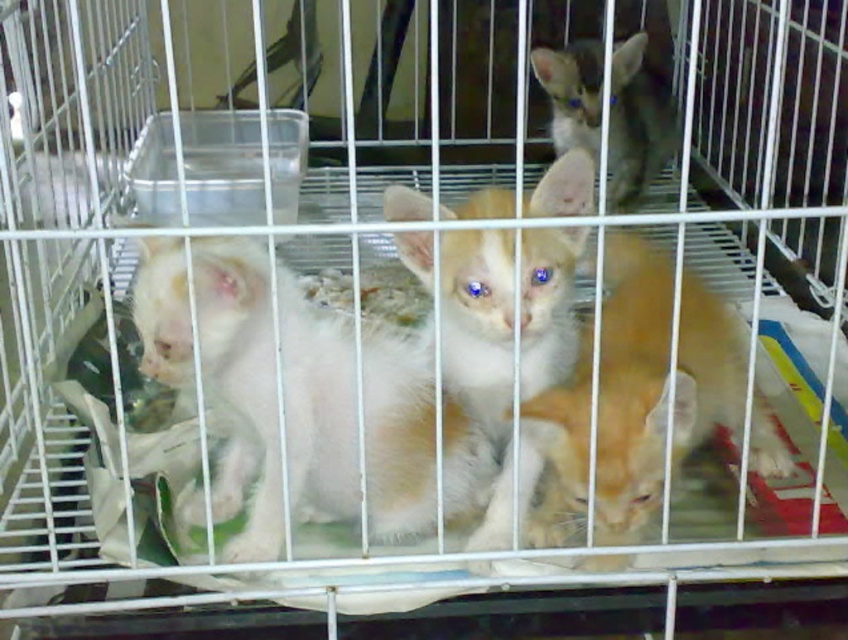
Based on the scene description, can the orange fur cat at center fit inside the transparent plastic container at center? Please explain your reasoning using the provided details.

The orange fur cat at center is narrower than the transparent plastic container at center, so it could potentially fit inside if the container has enough space. However, the scene description does not mention the container being open or accessible, so practical considerations like the container being closed or its purpose might prevent the cat from entering.

You are holding a camera and want to place a sticker exactly at point (411, 236) in the image. The sticker has a diameter of 2 inches. Will the sticker be entirely visible within the image frame?

The point (411, 236) is 30.78 inches away from the camera. Since the sticker has a diameter of 2 inches, which is smaller than the distance from the camera, the sticker will be entirely visible within the image frame.

You are observing a group of kittens in a metal cage. The cage has vertical bars creating a grid pattern, and the interior is lined with crumpled material. You see a fluffy white kitten at center. Where is the fluffy white kitten positioned in relation to the cage?

The fluffy white kitten at center is located at point coordinates approximately 0.552 on the horizontal axis and 0.568 on the vertical axis within the cage.